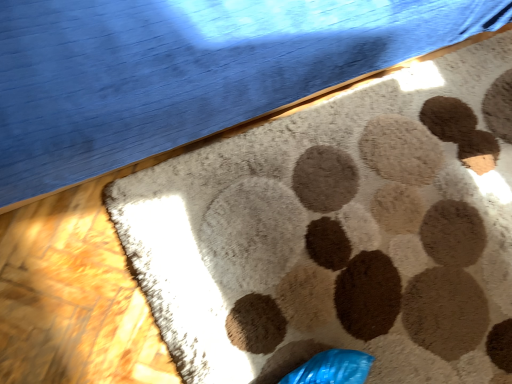
Question: From a real-world perspective, is beige textured rug at center located beneath beige carpet at center?

Choices:
 (A) yes
 (B) no

Answer: (A)

Question: Is beige textured rug at center at the left side of beige carpet at center?

Choices:
 (A) no
 (B) yes

Answer: (A)

Question: Does beige textured rug at center have a lesser width compared to beige carpet at center?

Choices:
 (A) no
 (B) yes

Answer: (A)

Question: Can you confirm if beige textured rug at center is taller than beige carpet at center?

Choices:
 (A) no
 (B) yes

Answer: (A)

Question: From a real-world perspective, is beige textured rug at center on top of beige carpet at center?

Choices:
 (A) yes
 (B) no

Answer: (B)

Question: Is beige textured rug at center located outside beige carpet at center?

Choices:
 (A) no
 (B) yes

Answer: (B)

Question: Is beige carpet at center to the right of beige textured rug at center from the viewer's perspective?

Choices:
 (A) yes
 (B) no

Answer: (B)

Question: Is beige carpet at center taller than beige textured rug at center?

Choices:
 (A) yes
 (B) no

Answer: (A)

Question: From a real-world perspective, is beige carpet at center over beige textured rug at center?

Choices:
 (A) yes
 (B) no

Answer: (A)

Question: Is beige carpet at center outside beige textured rug at center?

Choices:
 (A) yes
 (B) no

Answer: (A)

Question: Considering the relative sizes of beige carpet at center and beige textured rug at center in the image provided, is beige carpet at center bigger than beige textured rug at center?

Choices:
 (A) yes
 (B) no

Answer: (A)

Question: Is beige textured rug at center at the back of beige carpet at center?

Choices:
 (A) no
 (B) yes

Answer: (A)

Question: Considering the positions of beige carpet at center and beige textured rug at center in the image, is beige carpet at center bigger or smaller than beige textured rug at center?

Choices:
 (A) small
 (B) big

Answer: (B)